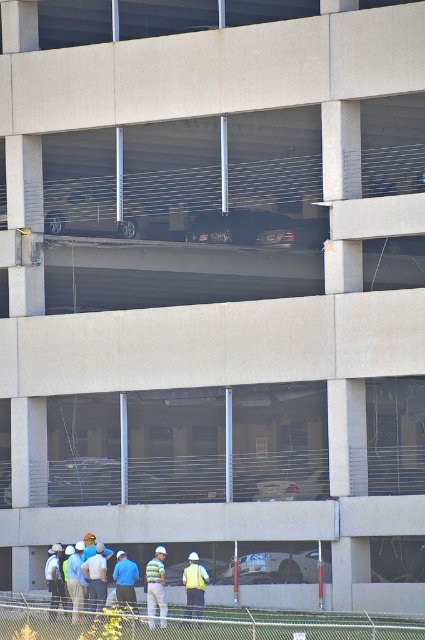
Question: Is reflective yellow vest at center smaller than reflective yellow safety vest at lower center?

Choices:
 (A) no
 (B) yes

Answer: (B)

Question: Which of the following is the farthest from the observer?

Choices:
 (A) reflective yellow safety vest at lower center
 (B) blue fabric shirt at lower center
 (C) reflective yellow vest at center

Answer: (B)

Question: Can you confirm if reflective yellow vest at center is positioned to the left of reflective yellow safety vest at lower center?

Choices:
 (A) no
 (B) yes

Answer: (A)

Question: Which of the following is the farthest from the observer?

Choices:
 (A) blue fabric shirt at lower center
 (B) reflective yellow safety vest at lower center

Answer: (A)

Question: Can you confirm if reflective yellow vest at center is thinner than reflective yellow safety vest at lower center?

Choices:
 (A) yes
 (B) no

Answer: (A)

Question: Which point appears farthest from the camera in this image?

Choices:
 (A) (189, 573)
 (B) (203, 588)
 (C) (116, 557)

Answer: (C)